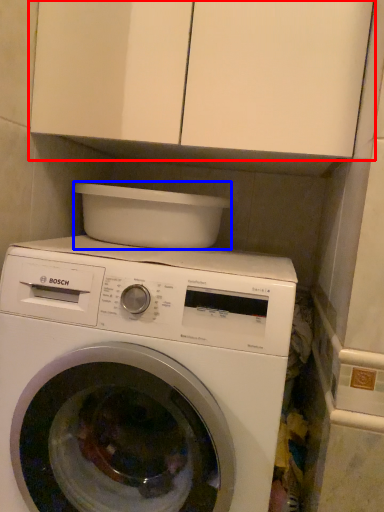
Question: Among these objects, which one is nearest to the camera, cabinetry (highlighted by a red box) or appliance (highlighted by a blue box)?

Choices:
 (A) cabinetry
 (B) appliance

Answer: (A)